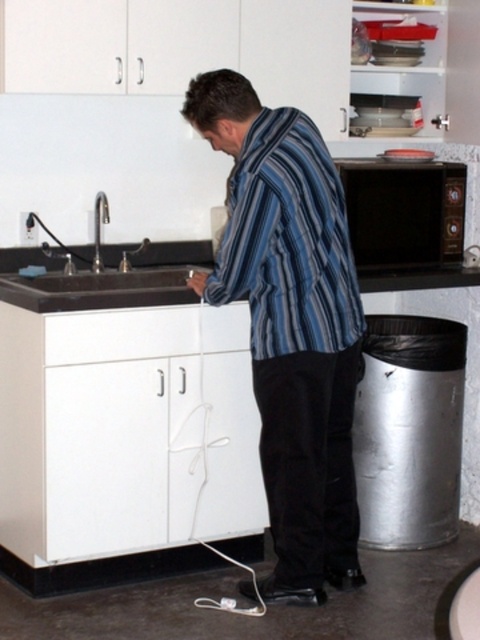
Question: Estimate the real-world distances between objects in this image. Which object is farther from the blue striped shirt at center?

Choices:
 (A) brushed metal faucet at left
 (B) black matte microwave at upper right
 (C) striped cotton shirt at center
 (D) black granite sink at left

Answer: (A)

Question: Is blue striped shirt at center below black granite sink at left?

Choices:
 (A) no
 (B) yes

Answer: (B)

Question: Does blue striped shirt at center appear under brushed metal faucet at left?

Choices:
 (A) yes
 (B) no

Answer: (A)

Question: Considering the relative positions of striped cotton shirt at center and black matte microwave at upper right in the image provided, where is striped cotton shirt at center located with respect to black matte microwave at upper right?

Choices:
 (A) right
 (B) left

Answer: (B)

Question: Which object is positioned farthest from the black matte microwave at upper right?

Choices:
 (A) black granite sink at left
 (B) brushed metal faucet at left
 (C) blue striped shirt at center
 (D) striped cotton shirt at center

Answer: (B)

Question: Which object is the farthest from the white matte drawer at lower center?

Choices:
 (A) striped cotton shirt at center
 (B) brushed metal faucet at left

Answer: (B)